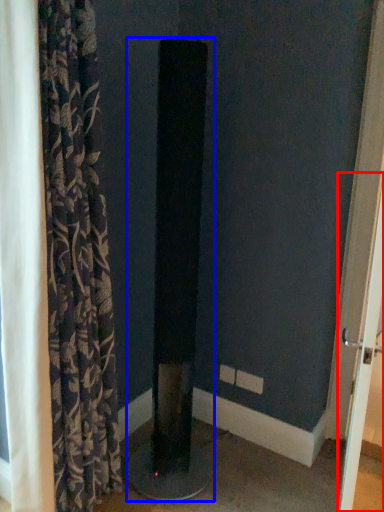
Question: Which object appears closest to the camera in this image, screen door (highlighted by a red box) or pillar (highlighted by a blue box)?

Choices:
 (A) screen door
 (B) pillar

Answer: (A)